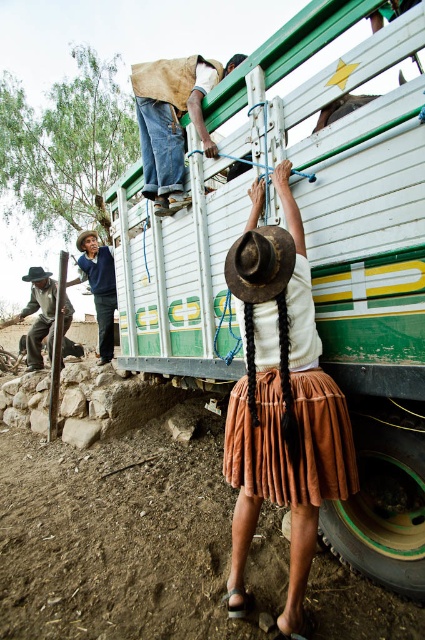
Does brown canvas bag at upper center have a smaller size compared to brown straw hat at upper center?

Incorrect, brown canvas bag at upper center is not smaller in size than brown straw hat at upper center.

Can you confirm if brown canvas bag at upper center is positioned to the left of brown straw hat at upper center?

No, brown canvas bag at upper center is not to the left of brown straw hat at upper center.

Where is `brown canvas bag at upper center`? brown canvas bag at upper center is located at coordinates (172, 120).

Is blue sweater at lower left below brown felt cowboy hat at center?

Indeed, blue sweater at lower left is positioned under brown felt cowboy hat at center.

Who is lower down, blue sweater at lower left or brown felt cowboy hat at center?

blue sweater at lower left is lower down.

Does point (73, 284) come behind point (48, 276)?

No, (73, 284) is closer to viewer.

Where is `blue sweater at lower left`? The height and width of the screenshot is (640, 425). blue sweater at lower left is located at coordinates (99, 288).

Who is more distant from viewer, (68, 307) or (39, 280)?

Positioned behind is point (39, 280).

Which is more to the right, brown leather hat at left or brown felt cowboy hat at center?

Positioned to the right is brown leather hat at left.

Identify the location of brown leather hat at left. (39, 316).